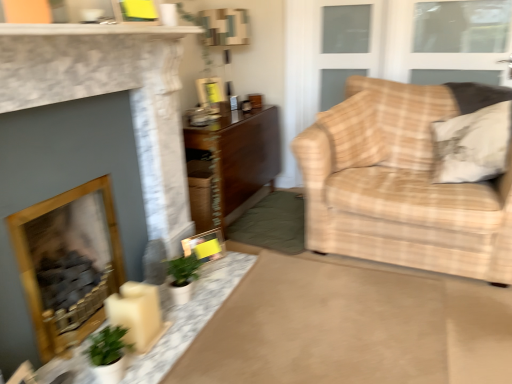
Describe the element at coordinates (472, 145) in the screenshot. I see `white textured pillow at right` at that location.

What are the coordinates of `white marble table at center, the 1th table when ordered from bottom to top` in the screenshot? It's located at (189, 316).

What is the approximate width of beige plaid fabric couch at right?

beige plaid fabric couch at right is 1.04 meters in width.

In order to click on white textured pillow at right in this screenshot , I will do `click(472, 145)`.

Between point (412, 131) and point (93, 225), which one is positioned behind?

The point (412, 131) is behind.

Find the location of a particular element. Image resolution: width=512 pixels, height=384 pixels. fireplace that appears below the beige plaid fabric couch at right (from a real-world perspective) is located at coordinates (68, 263).

Can you confirm if beige plaid fabric couch at right is smaller than wooden fireplace at left, the first fireplace positioned from the back?

Actually, beige plaid fabric couch at right might be larger than wooden fireplace at left, the first fireplace positioned from the back.

From a real-world perspective, who is located higher, beige plaid fabric couch at right or wooden fireplace at left, which is the second fireplace from front to back?

In real-world perspective, beige plaid fabric couch at right is above.

Is point (47, 326) in front of point (215, 80)?

Yes.

From a real-world perspective, is wooden fireplace at left, the first fireplace positioned from the back, beneath matte plastic picture frame at upper center, which is the 2th picture frame in front-to-back order?

Yes, from a real-world perspective, wooden fireplace at left, the first fireplace positioned from the back, is beneath matte plastic picture frame at upper center, which is the 2th picture frame in front-to-back order.

Where is `picture frame above the wooden fireplace at left, which is the second fireplace from front to back (from a real-world perspective)`? This screenshot has width=512, height=384. picture frame above the wooden fireplace at left, which is the second fireplace from front to back (from a real-world perspective) is located at coordinates (210, 91).

How many degrees apart are the facing directions of wooden fireplace at left, which is the second fireplace from front to back, and matte plastic picture frame at upper center, which is the 2th picture frame in front-to-back order?

There is a 27.1-degree angle between the facing directions of wooden fireplace at left, which is the second fireplace from front to back, and matte plastic picture frame at upper center, which is the 2th picture frame in front-to-back order.

Considering the positions of point (21, 64) and point (91, 30), is point (21, 64) closer or farther from the camera than point (91, 30)?

Point (21, 64) is positioned farther from the camera compared to point (91, 30).

From the image's perspective, is matte stone fireplace at left, the second fireplace in the back-to-front sequence, below white marble mantle at upper center?

Yes.

Is matte stone fireplace at left, the second fireplace in the back-to-front sequence, with white marble mantle at upper center?

No, matte stone fireplace at left, the second fireplace in the back-to-front sequence, is not touching white marble mantle at upper center.

Is matte stone fireplace at left, the second fireplace in the back-to-front sequence, positioned far away from matte plastic picture frame at upper center, positioned as the 1th picture frame in back-to-front order?

Yes, matte stone fireplace at left, the second fireplace in the back-to-front sequence, and matte plastic picture frame at upper center, positioned as the 1th picture frame in back-to-front order, are located far from each other.

Is matte stone fireplace at left, the 1th fireplace when ordered from front to back, positioned behind matte plastic picture frame at upper center, acting as the 2th picture frame starting from the bottom?

That is False.

Between matte stone fireplace at left, the second fireplace in the back-to-front sequence, and matte plastic picture frame at upper center, positioned as the 1th picture frame in back-to-front order, which one has more height?

matte stone fireplace at left, the second fireplace in the back-to-front sequence, is taller.

From the image's perspective, is matte stone fireplace at left, the 1th fireplace when ordered from front to back, above matte plastic picture frame at upper center, placed as the first picture frame when sorted from top to bottom?

No, from the image's perspective, matte stone fireplace at left, the 1th fireplace when ordered from front to back, is not on top of matte plastic picture frame at upper center, placed as the first picture frame when sorted from top to bottom.

Looking at this image, is the surface of white marble table at center, marked as the 2th table in a back-to-front arrangement, in direct contact with clear glass window at upper right, arranged as the 2th window when viewed from the top?

No, white marble table at center, marked as the 2th table in a back-to-front arrangement, is not next to clear glass window at upper right, arranged as the 2th window when viewed from the top.

From the image's perspective, which object appears higher, white marble table at center, the 2th table positioned from the top, or clear glass window at upper right, which appears as the first window when ordered from the bottom?

clear glass window at upper right, which appears as the first window when ordered from the bottom, is shown above in the image.

Is white marble table at center, the 1th table positioned from the front, turned away from clear glass window at upper right, which appears as the first window when ordered from the bottom?

white marble table at center, the 1th table positioned from the front, does not have its back to clear glass window at upper right, which appears as the first window when ordered from the bottom.

Would you say matte plastic picture frame at upper center, positioned as the 1th picture frame in back-to-front order, is inside or outside wooden fireplace at left, the first fireplace positioned from the back?

matte plastic picture frame at upper center, positioned as the 1th picture frame in back-to-front order, lies outside wooden fireplace at left, the first fireplace positioned from the back.

In the image, is matte plastic picture frame at upper center, acting as the 2th picture frame starting from the bottom, positioned in front of or behind wooden fireplace at left, which is the second fireplace from front to back?

Clearly, matte plastic picture frame at upper center, acting as the 2th picture frame starting from the bottom, is behind wooden fireplace at left, which is the second fireplace from front to back.

From the image's perspective, is matte plastic picture frame at upper center, which is the 2th picture frame in front-to-back order, on top of wooden fireplace at left, the first fireplace positioned from the back?

Yes, from the image's perspective, matte plastic picture frame at upper center, which is the 2th picture frame in front-to-back order, is on top of wooden fireplace at left, the first fireplace positioned from the back.

Looking at this image, is matte plastic picture frame at upper center, which is the 2th picture frame in front-to-back order, bigger or smaller than wooden fireplace at left, which is the second fireplace from front to back?

Considering their sizes, matte plastic picture frame at upper center, which is the 2th picture frame in front-to-back order, takes up less space than wooden fireplace at left, which is the second fireplace from front to back.

Who is smaller, clear glass window at upper right, which appears as the first window when ordered from the bottom, or yellow paper picture frame at center, the 2th picture frame positioned from the top?

With smaller size is yellow paper picture frame at center, the 2th picture frame positioned from the top.

Does clear glass window at upper right, arranged as the 2th window when viewed from the top, have a lesser height compared to yellow paper picture frame at center, which appears as the 1th picture frame when ordered from the bottom?

Incorrect, the height of clear glass window at upper right, arranged as the 2th window when viewed from the top, does not fall short of that of yellow paper picture frame at center, which appears as the 1th picture frame when ordered from the bottom.

Which is more to the left, clear glass window at upper right, which appears as the first window when ordered from the bottom, or yellow paper picture frame at center, the 2th picture frame positioned from the top?

Positioned to the left is yellow paper picture frame at center, the 2th picture frame positioned from the top.

Is clear glass window at upper right, which appears as the first window when ordered from the bottom, in front of yellow paper picture frame at center, which is counted as the second picture frame, starting from the back?

No, the depth of clear glass window at upper right, which appears as the first window when ordered from the bottom, is greater than that of yellow paper picture frame at center, which is counted as the second picture frame, starting from the back.

Where is `the 1st fireplace in front of the beige plaid fabric couch at right`? the 1st fireplace in front of the beige plaid fabric couch at right is located at coordinates (68, 263).

Locate an element on the screen. The width and height of the screenshot is (512, 384). picture frame located above the wooden fireplace at left, the first fireplace positioned from the back (from a real-world perspective) is located at coordinates (210, 91).

Considering their positions, is wooden fireplace at left, the first fireplace positioned from the back, positioned closer to matte plastic picture frame at upper center, acting as the 2th picture frame starting from the bottom, than clear glass window at upper right, which appears as the first window when ordered from the bottom?

clear glass window at upper right, which appears as the first window when ordered from the bottom, lies closer to matte plastic picture frame at upper center, acting as the 2th picture frame starting from the bottom, than the other object.

From the image, which object appears to be nearer to white textured pillow at right, clear glass window at upper right, arranged as the 2th window when viewed from the top, or transparent glass window at upper right, placed as the second window when sorted from bottom to top?

transparent glass window at upper right, placed as the second window when sorted from bottom to top.

From the image, which object appears to be farther from matte plastic picture frame at upper center, which is the 2th picture frame in front-to-back order, white marble mantle at upper center or white marble table at center, the 2th table positioned from the top?

The object further to matte plastic picture frame at upper center, which is the 2th picture frame in front-to-back order, is white marble table at center, the 2th table positioned from the top.

Consider the image. Which object lies nearer to the anchor point clear glass window at upper right, arranged as the 2th window when viewed from the top, transparent glass window at upper right, placed as the second window when sorted from bottom to top, or white textured pillow at right?

The object closer to clear glass window at upper right, arranged as the 2th window when viewed from the top, is transparent glass window at upper right, placed as the second window when sorted from bottom to top.

Based on their spatial positions, is wooden table at center, which is counted as the first table, starting from the top, or yellow paper picture frame at center, the first picture frame from the front, closer to clear glass window at upper right, which appears as the first window when ordered from the bottom?

wooden table at center, which is counted as the first table, starting from the top, is positioned closer to the anchor clear glass window at upper right, which appears as the first window when ordered from the bottom.

Estimate the real-world distances between objects in this image. Which object is further from yellow paper picture frame at center, which appears as the 1th picture frame when ordered from the bottom, beige plaid fabric couch at right or matte plastic picture frame at upper center, which is the 2th picture frame in front-to-back order?

matte plastic picture frame at upper center, which is the 2th picture frame in front-to-back order, lies further to yellow paper picture frame at center, which appears as the 1th picture frame when ordered from the bottom, than the other object.

Estimate the real-world distances between objects in this image. Which object is closer to matte stone fireplace at left, the second fireplace in the back-to-front sequence, matte plastic picture frame at upper center, which is the 2th picture frame in front-to-back order, or beige plaid fabric couch at right?

Based on the image, beige plaid fabric couch at right appears to be nearer to matte stone fireplace at left, the second fireplace in the back-to-front sequence.

Considering their positions, is wooden table at center, the second table when ordered from bottom to top, positioned further to transparent glass window at upper right, positioned as the first window in top-to-bottom order, than beige plaid fabric couch at right?

wooden table at center, the second table when ordered from bottom to top, is further to transparent glass window at upper right, positioned as the first window in top-to-bottom order.

Where is `studio couch situated between white marble mantle at upper center and clear glass window at upper right, which appears as the first window when ordered from the bottom, from left to right`? Image resolution: width=512 pixels, height=384 pixels. studio couch situated between white marble mantle at upper center and clear glass window at upper right, which appears as the first window when ordered from the bottom, from left to right is located at coordinates (399, 186).

The width and height of the screenshot is (512, 384). I want to click on table between matte plastic picture frame at upper center, which is the 2th picture frame in front-to-back order, and yellow paper picture frame at center, which is counted as the second picture frame, starting from the back, from top to bottom, so click(x=231, y=164).

Where is `picture frame between white marble mantle at upper center and wooden table at center, which is counted as the first table, starting from the top, along the z-axis`? This screenshot has height=384, width=512. picture frame between white marble mantle at upper center and wooden table at center, which is counted as the first table, starting from the top, along the z-axis is located at coordinates (205, 245).

Find the location of a particular element. This screenshot has height=384, width=512. studio couch between white marble table at center, the 1th table positioned from the front, and matte plastic picture frame at upper center, placed as the first picture frame when sorted from top to bottom, in the front-back direction is located at coordinates (399, 186).